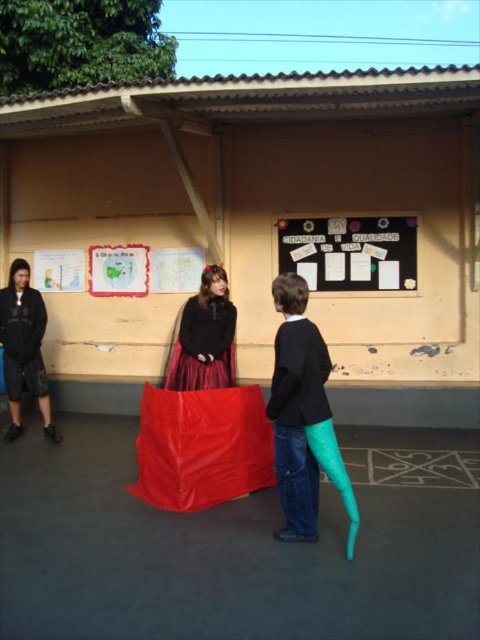
You are a photographer trying to capture the person in the red skirt and black top. Since the red tarpaulin at center and matte black sweater at center are both in the way, which object should you move to get a clearer view of the subject?

The red tarpaulin at center is thinner than the matte black sweater at center, so moving the red tarpaulin at center would allow you to see through it better, providing a clearer view of the subject.

What is the position of the red tarpaulin at center in the image?

The red tarpaulin at center is located at point 0.330 in the x coordinate and 0.535 in the y coordinate.

Based on the photo, you are standing in front of the beige wall and want to hang a new poster. The red tarpaulin at center and the black matte bulletin board at upper center are in your way. Which object is closer to you, making it harder to reach the wall?

The red tarpaulin at center is closer to the viewer than the black matte bulletin board at upper center, so it is the closer object obstructing access to the wall.